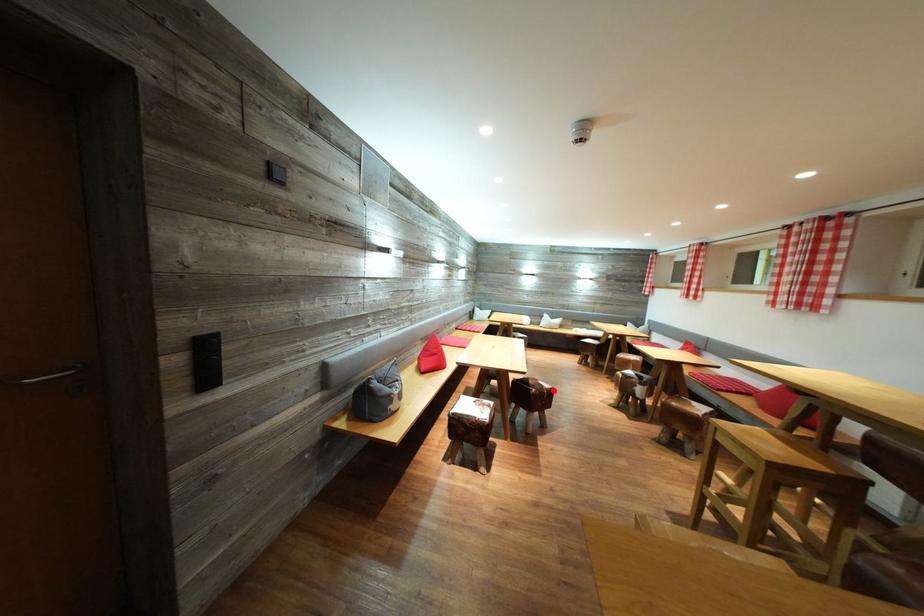
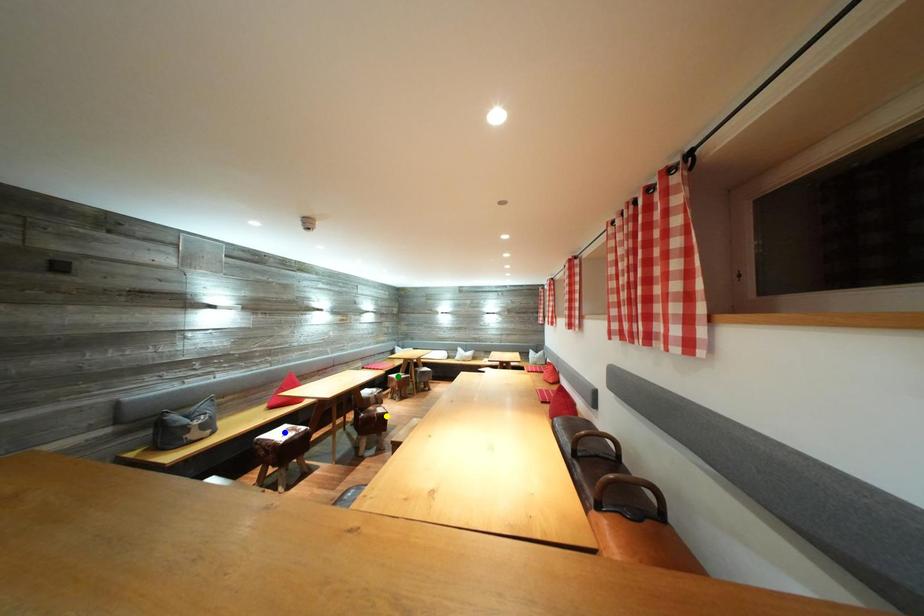
Question: I am providing you with two images of the same scene from different viewpoints. A red point is marked on the first image. You are given multiple points on the second image. In image 2, which mark is for the same physical point as the one in image 1?

Choices:
 (A) yellow point
 (B) blue point
 (C) green point

Answer: (A)